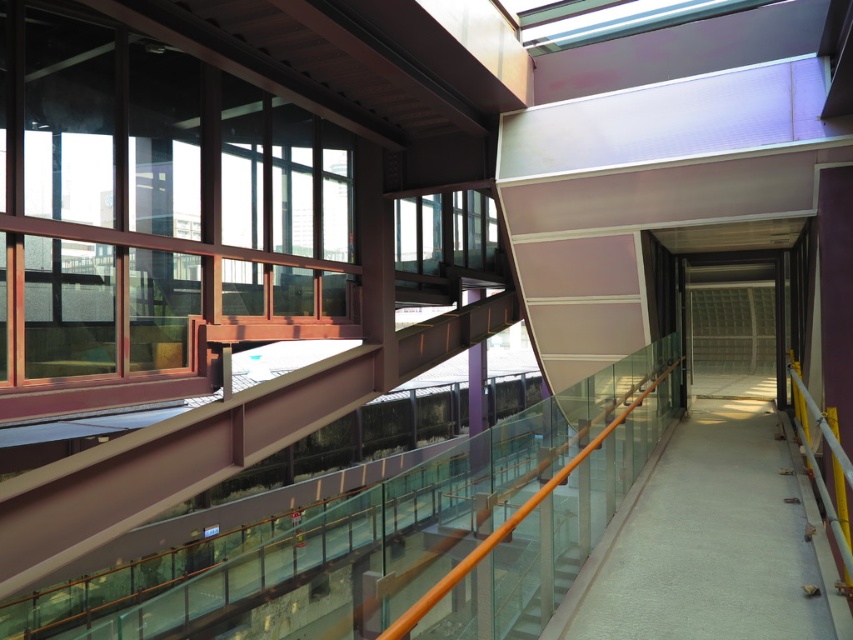
Is smooth concrete walkway at center smaller than white glossy stairs at center?

Incorrect, smooth concrete walkway at center is not smaller in size than white glossy stairs at center.

Who is lower down, smooth concrete walkway at center or white glossy stairs at center?

smooth concrete walkway at center

Is point (827, 557) farther from camera compared to point (527, 634)?

Yes, it is behind point (527, 634).

The image size is (853, 640). Find the location of `smooth concrete walkway at center`. smooth concrete walkway at center is located at coordinates (712, 541).